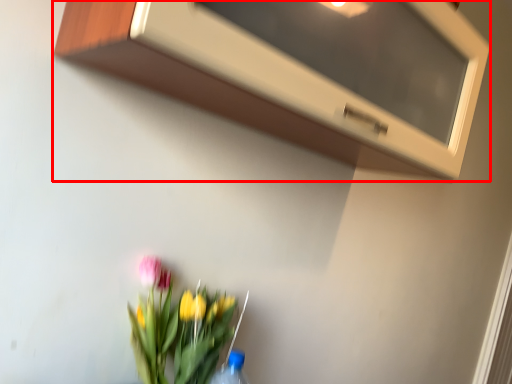
Question: From the image's perspective, what is the correct spatial relationship of microwave (annotated by the red box) in relation to floral arrangement?

Choices:
 (A) above
 (B) below

Answer: (A)